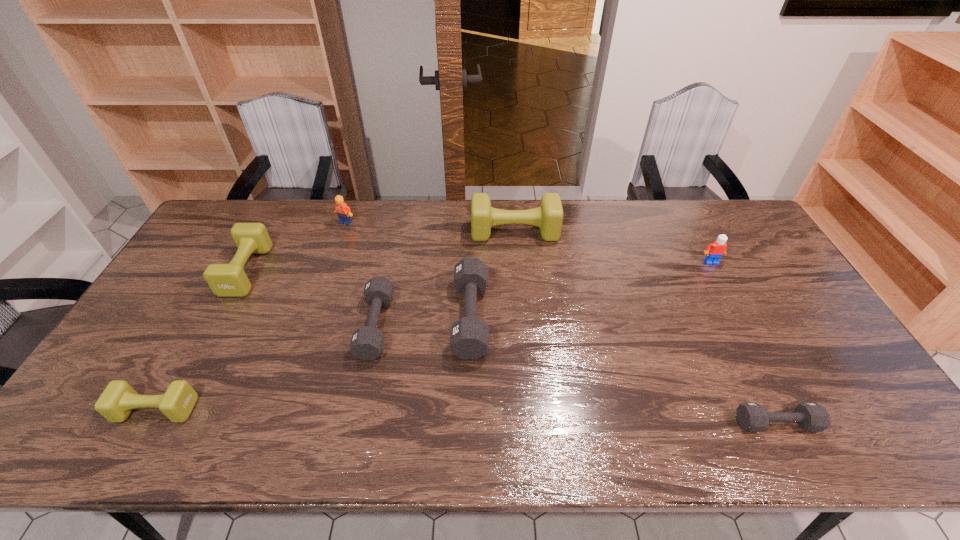
The height and width of the screenshot is (540, 960). I want to click on free space in the image that satisfies the following two spatial constraints: 1. on the front-facing side of the farther Lego; 2. on the left side of the biggest gray dumbbell, so pyautogui.click(x=313, y=317).